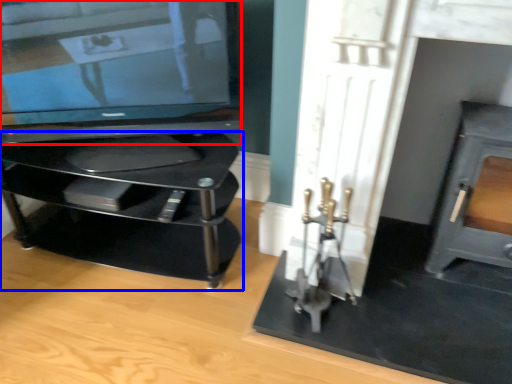
Question: Among these objects, which one is farthest to the camera, television (highlighted by a red box) or furniture (highlighted by a blue box)?

Choices:
 (A) television
 (B) furniture

Answer: (B)